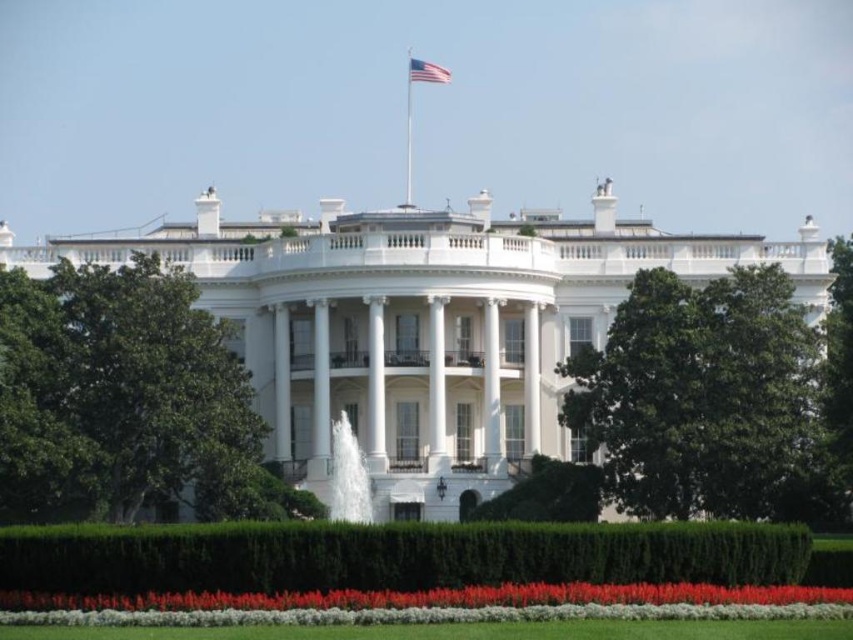
Question: Is smooth glossy flowers at lower center positioned in front of green grass at lower center?

Choices:
 (A) yes
 (B) no

Answer: (B)

Question: Which object appears farthest from the camera in this image?

Choices:
 (A) green grass at lower center
 (B) american flag at upper center
 (C) smooth glossy flowers at lower center
 (D) metallic flag pole at upper center

Answer: (B)

Question: Does smooth glossy flowers at lower center have a smaller size compared to green grass at lower center?

Choices:
 (A) yes
 (B) no

Answer: (B)

Question: Among these points, which one is farthest from the camera?

Choices:
 (A) (141, 556)
 (B) (514, 496)
 (C) (502, 632)

Answer: (B)

Question: Which point appears closest to the camera in this image?

Choices:
 (A) (434, 65)
 (B) (380, 604)
 (C) (357, 582)
 (D) (49, 634)

Answer: (D)

Question: Does smooth glossy flowers at lower center appear over american flag at upper center?

Choices:
 (A) no
 (B) yes

Answer: (A)